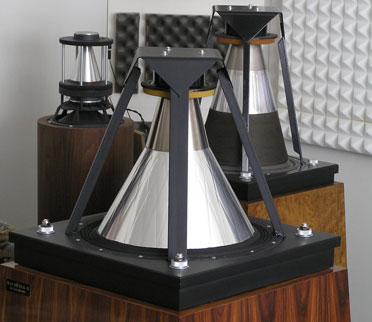
Identify the location of wall. (27, 51).